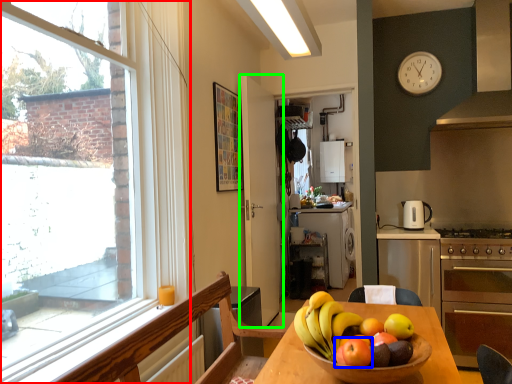
Question: Which object is positioned closest to window (highlighted by a red box)? Select from apple (highlighted by a blue box) and door (highlighted by a green box).

Choices:
 (A) apple
 (B) door

Answer: (B)